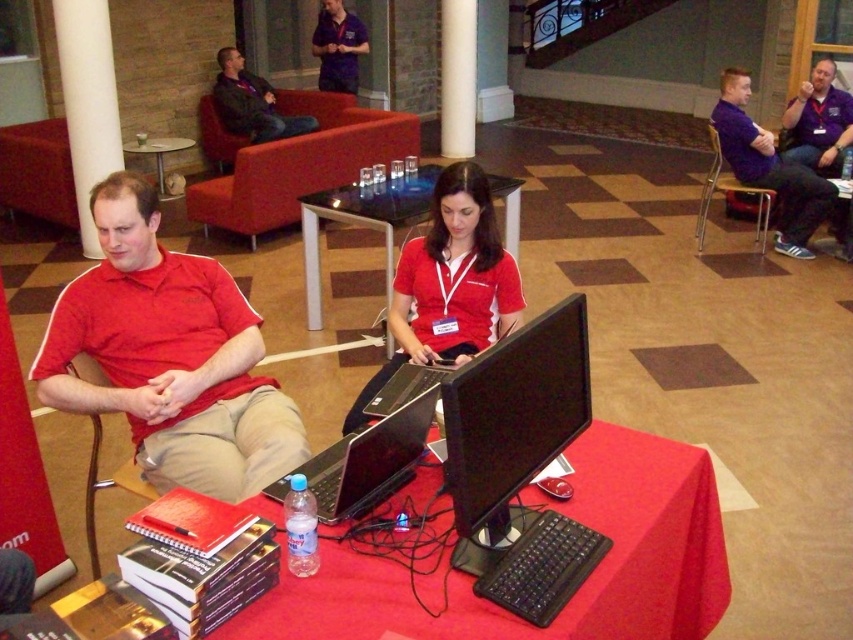
Question: Does black glossy monitor at center appear on the left side of black glass table at center?

Choices:
 (A) yes
 (B) no

Answer: (B)

Question: Considering the real-world distances, which object is farthest from the dark blue jacket at upper center?

Choices:
 (A) black glass table at center
 (B) black glossy monitor at center
 (C) white smooth pillar at upper left
 (D) glass transparent table at upper center

Answer: (B)

Question: In this image, where is dark blue jacket at upper center located relative to glass transparent table at upper center?

Choices:
 (A) left
 (B) right

Answer: (B)

Question: Which point is closer to the camera?

Choices:
 (A) purple smooth polo shirt at upper center
 (B) purple cotton shirt at upper right
 (C) dark blue jacket at upper center

Answer: (B)

Question: Among these objects, which one is farthest from the camera?

Choices:
 (A) black plastic laptop at center
 (B) white smooth pillar at center
 (C) red cotton polo shirt at left
 (D) black glass table at center

Answer: (B)

Question: Can you confirm if black glossy monitor at center is positioned above purple smooth polo shirt at upper center?

Choices:
 (A) no
 (B) yes

Answer: (A)